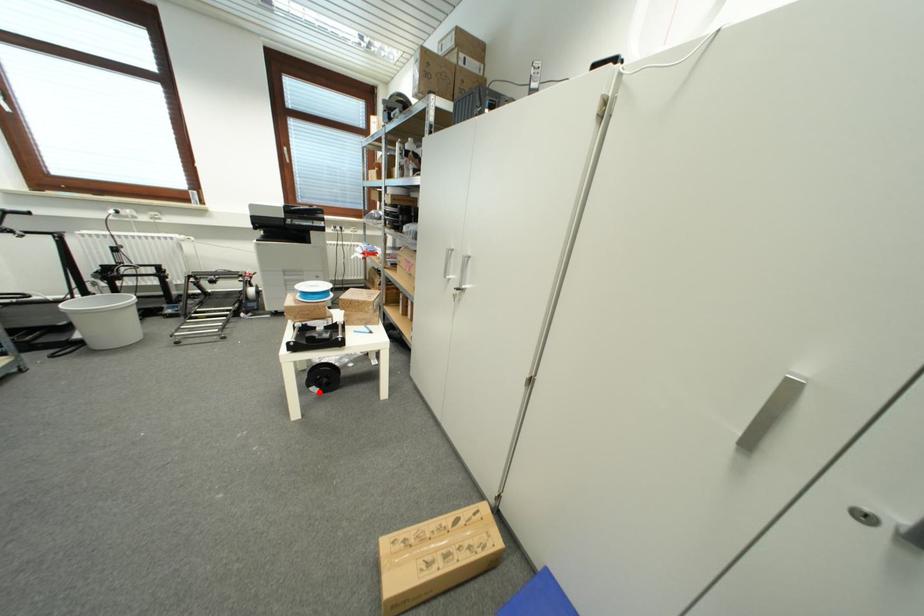
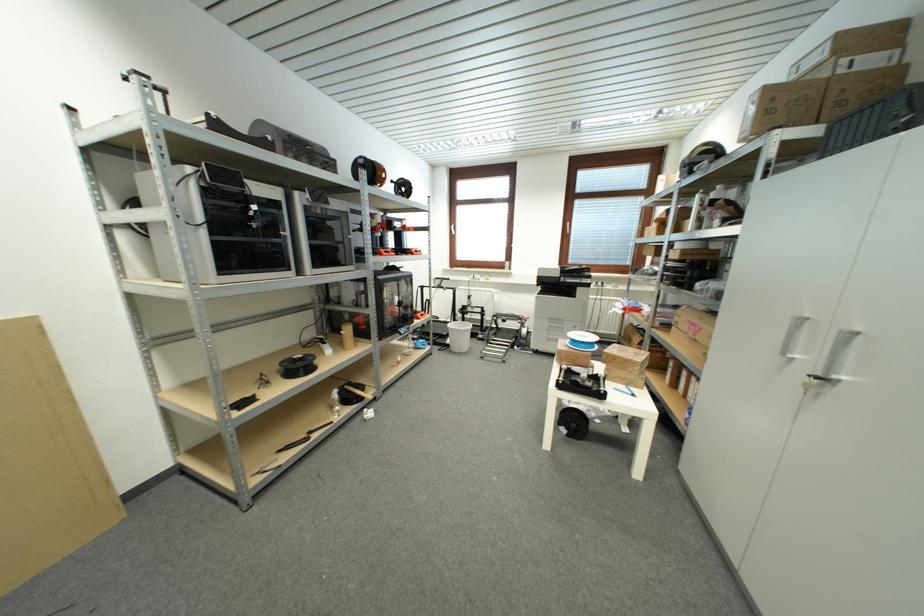
Question: A red point is marked in image1. In image2, is the corresponding 3D point closer to the camera or farther? Reply with the corresponding letter.

Choices:
 (A) The corresponding 3D point is closer.
 (B) The corresponding 3D point is farther.

Answer: (B)